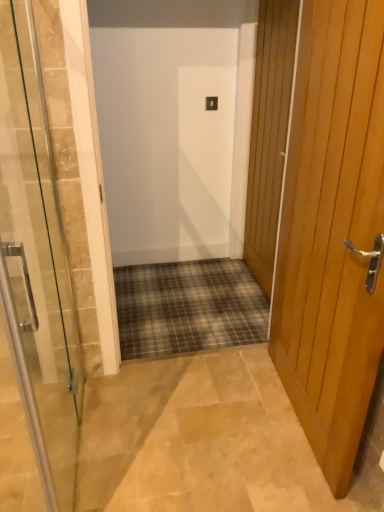
Measure the distance between wooden door at right, which is the 3th door from left to right, and camera.

The depth of wooden door at right, which is the 3th door from left to right, is 5.35 feet.

Locate an element on the screen. This screenshot has width=384, height=512. light brown wooden door at right, which appears as the second door when viewed from the left is located at coordinates (332, 231).

Can you confirm if wooden door at right, which is the 3th door from left to right, is bigger than light brown wooden door at right, which appears as the second door when viewed from the left?

No, wooden door at right, which is the 3th door from left to right, is not bigger than light brown wooden door at right, which appears as the second door when viewed from the left.

Is wooden door at right, which is the 3th door from left to right, facing away from light brown wooden door at right, the 2th door positioned from the right?

wooden door at right, which is the 3th door from left to right, is not turned away from light brown wooden door at right, the 2th door positioned from the right.

From a real-world perspective, is wooden door at right, which is the 3th door from left to right, positioned under light brown wooden door at right, which appears as the second door when viewed from the left, based on gravity?

No, from a real-world perspective, wooden door at right, which is the 3th door from left to right, is not below light brown wooden door at right, which appears as the second door when viewed from the left.

Which object is further away from the camera, wooden door at right, which is the 3th door from left to right, or light brown wooden door at right, the 2th door positioned from the right?

wooden door at right, which is the 3th door from left to right.

Which object is more forward, light brown wooden door at right, which appears as the second door when viewed from the left, or clear glass door at center, the third door in the right-to-left sequence?

clear glass door at center, the third door in the right-to-left sequence, is closer to the camera.

Are light brown wooden door at right, which appears as the second door when viewed from the left, and clear glass door at center, the third door in the right-to-left sequence, making contact?

No, light brown wooden door at right, which appears as the second door when viewed from the left, is not touching clear glass door at center, the third door in the right-to-left sequence.

Based on the photo, could you tell me if light brown wooden door at right, which appears as the second door when viewed from the left, is facing clear glass door at center, acting as the first door starting from the left?

Yes.

Measure the distance between light brown wooden door at right, which appears as the second door when viewed from the left, and clear glass door at center, acting as the first door starting from the left.

light brown wooden door at right, which appears as the second door when viewed from the left, is 1.04 meters away from clear glass door at center, acting as the first door starting from the left.

Is clear glass door at center, the third door in the right-to-left sequence, not within wooden door at right, which is the 3th door from left to right?

clear glass door at center, the third door in the right-to-left sequence, is positioned outside wooden door at right, which is the 3th door from left to right.

How many degrees apart are the facing directions of clear glass door at center, acting as the first door starting from the left, and wooden door at right, positioned as the first door in right-to-left order?

There is a 180-degree angle between the facing directions of clear glass door at center, acting as the first door starting from the left, and wooden door at right, positioned as the first door in right-to-left order.

Considering the relative sizes of clear glass door at center, the third door in the right-to-left sequence, and wooden door at right, positioned as the first door in right-to-left order, in the image provided, is clear glass door at center, the third door in the right-to-left sequence, shorter than wooden door at right, positioned as the first door in right-to-left order,?

Yes, clear glass door at center, the third door in the right-to-left sequence, is shorter than wooden door at right, positioned as the first door in right-to-left order.

Between light brown wooden door at right, the 2th door positioned from the right, and wooden door at right, which is the 3th door from left to right, which one appears on the right side from the viewer's perspective?

Positioned to the right is wooden door at right, which is the 3th door from left to right.

Can you confirm if light brown wooden door at right, the 2th door positioned from the right, is wider than wooden door at right, positioned as the first door in right-to-left order?

Indeed, light brown wooden door at right, the 2th door positioned from the right, has a greater width compared to wooden door at right, positioned as the first door in right-to-left order.

Could wooden door at right, positioned as the first door in right-to-left order, be considered to be inside light brown wooden door at right, which appears as the second door when viewed from the left?

Definitely not — wooden door at right, positioned as the first door in right-to-left order, is not inside light brown wooden door at right, which appears as the second door when viewed from the left.

Identify the location of the 1st door positioned below the wooden door at right, positioned as the first door in right-to-left order (from a real-world perspective). (332, 231).

Measure the distance from clear glass door at center, the third door in the right-to-left sequence, to light brown wooden door at right, the 2th door positioned from the right.

clear glass door at center, the third door in the right-to-left sequence, is 3.42 feet from light brown wooden door at right, the 2th door positioned from the right.

Could you tell me if clear glass door at center, acting as the first door starting from the left, is turned towards light brown wooden door at right, which appears as the second door when viewed from the left?

Yes.

Is clear glass door at center, the third door in the right-to-left sequence, bigger or smaller than light brown wooden door at right, which appears as the second door when viewed from the left?

Clearly, clear glass door at center, the third door in the right-to-left sequence, is smaller in size than light brown wooden door at right, which appears as the second door when viewed from the left.

Which is more to the left, clear glass door at center, the third door in the right-to-left sequence, or light brown wooden door at right, which appears as the second door when viewed from the left?

From the viewer's perspective, clear glass door at center, the third door in the right-to-left sequence, appears more on the left side.

From their relative heights in the image, would you say wooden door at right, positioned as the first door in right-to-left order, is taller or shorter than clear glass door at center, acting as the first door starting from the left?

Clearly, wooden door at right, positioned as the first door in right-to-left order, is taller compared to clear glass door at center, acting as the first door starting from the left.

Is wooden door at right, positioned as the first door in right-to-left order, not within clear glass door at center, acting as the first door starting from the left?

Indeed, wooden door at right, positioned as the first door in right-to-left order, is completely outside clear glass door at center, acting as the first door starting from the left.

Looking at this image, does wooden door at right, which is the 3th door from left to right, have a smaller size compared to clear glass door at center, the third door in the right-to-left sequence?

Yes, wooden door at right, which is the 3th door from left to right, is smaller than clear glass door at center, the third door in the right-to-left sequence.

Where is `door that is the 1st one when counting leftward from the wooden door at right, positioned as the first door in right-to-left order`? The image size is (384, 512). door that is the 1st one when counting leftward from the wooden door at right, positioned as the first door in right-to-left order is located at coordinates (332, 231).

Find the location of a particular element. the 1st door positioned above the clear glass door at center, acting as the first door starting from the left (from a real-world perspective) is located at coordinates (332, 231).

Looking at this image, looking at the image, which one is located closer to wooden door at right, positioned as the first door in right-to-left order, light brown wooden door at right, which appears as the second door when viewed from the left, or clear glass door at center, acting as the first door starting from the left?

Based on the image, light brown wooden door at right, which appears as the second door when viewed from the left, appears to be nearer to wooden door at right, positioned as the first door in right-to-left order.

When comparing their distances from clear glass door at center, the third door in the right-to-left sequence, does wooden door at right, which is the 3th door from left to right, or light brown wooden door at right, the 2th door positioned from the right, seem closer?

Among the two, light brown wooden door at right, the 2th door positioned from the right, is located nearer to clear glass door at center, the third door in the right-to-left sequence.

Which object lies nearer to the anchor point wooden door at right, positioned as the first door in right-to-left order, clear glass door at center, acting as the first door starting from the left, or light brown wooden door at right, which appears as the second door when viewed from the left?

light brown wooden door at right, which appears as the second door when viewed from the left.

When comparing their distances from light brown wooden door at right, which appears as the second door when viewed from the left, does wooden door at right, positioned as the first door in right-to-left order, or clear glass door at center, acting as the first door starting from the left, seem further?

clear glass door at center, acting as the first door starting from the left.

From the image, which object appears to be farther from light brown wooden door at right, the 2th door positioned from the right, clear glass door at center, the third door in the right-to-left sequence, or wooden door at right, positioned as the first door in right-to-left order?

clear glass door at center, the third door in the right-to-left sequence.

Estimate the real-world distances between objects in this image. Which object is closer to clear glass door at center, acting as the first door starting from the left, light brown wooden door at right, which appears as the second door when viewed from the left, or wooden door at right, which is the 3th door from left to right?

light brown wooden door at right, which appears as the second door when viewed from the left.

Where is `door between clear glass door at center, the third door in the right-to-left sequence, and wooden door at right, which is the 3th door from left to right, in the front-back direction`? door between clear glass door at center, the third door in the right-to-left sequence, and wooden door at right, which is the 3th door from left to right, in the front-back direction is located at coordinates (332, 231).